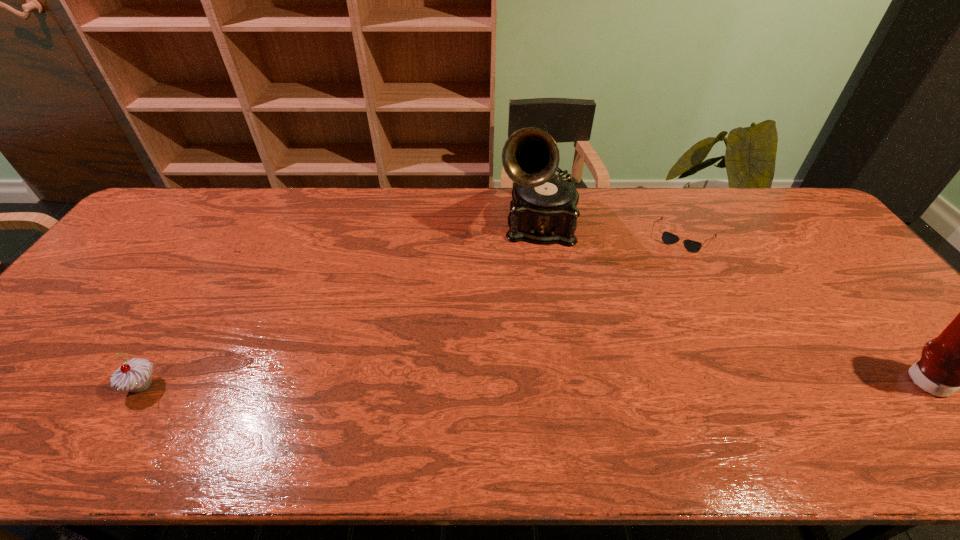
The width and height of the screenshot is (960, 540). I want to click on cupcake, so click(135, 375).

At what (x,y) coordinates should I click in order to perform the action: click on the second shortest object. Please return your answer as a coordinate pair (x, y). Looking at the image, I should click on (135, 375).

Find the location of a particular element. The height and width of the screenshot is (540, 960). sunglasses is located at coordinates (668, 238).

I want to click on the shortest object, so click(668, 238).

The height and width of the screenshot is (540, 960). I want to click on the tallest object, so click(543, 210).

At what (x,y) coordinates should I click in order to perform the action: click on the second object from left to right. Please return your answer as a coordinate pair (x, y). Looking at the image, I should click on (543, 210).

At what (x,y) coordinates should I click in order to perform the action: click on free location located on the back of the cupcake. Please return your answer as a coordinate pair (x, y). Looking at the image, I should click on (201, 290).

Locate an element on the screen. This screenshot has height=540, width=960. free region located 0.400m on the lenses of the third object from left to right is located at coordinates (635, 344).

Where is `free region located 0.320m on the lenses of the third object from left to right`? The width and height of the screenshot is (960, 540). free region located 0.320m on the lenses of the third object from left to right is located at coordinates (644, 322).

Where is `free space located on the lenses of the third object from left to right`? This screenshot has height=540, width=960. free space located on the lenses of the third object from left to right is located at coordinates (637, 338).